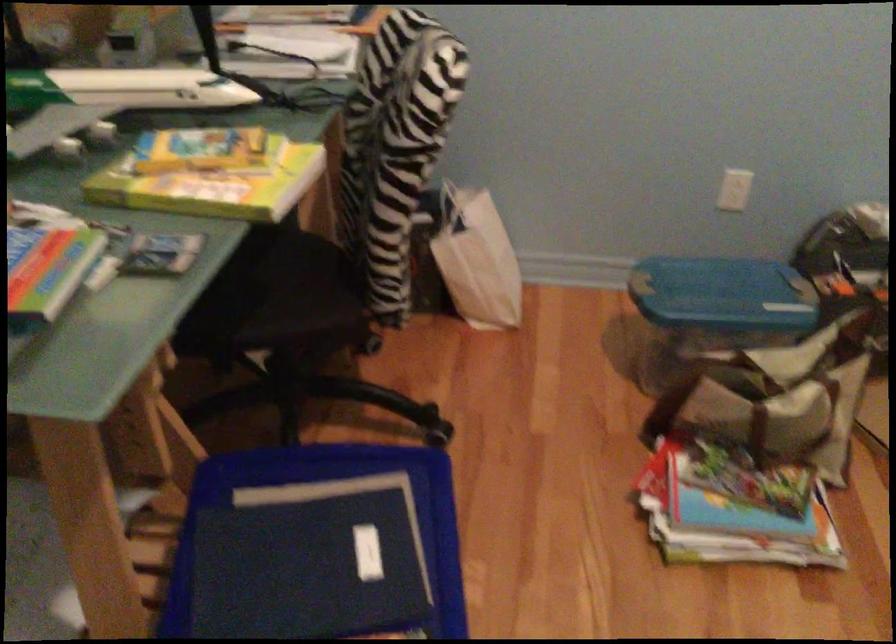
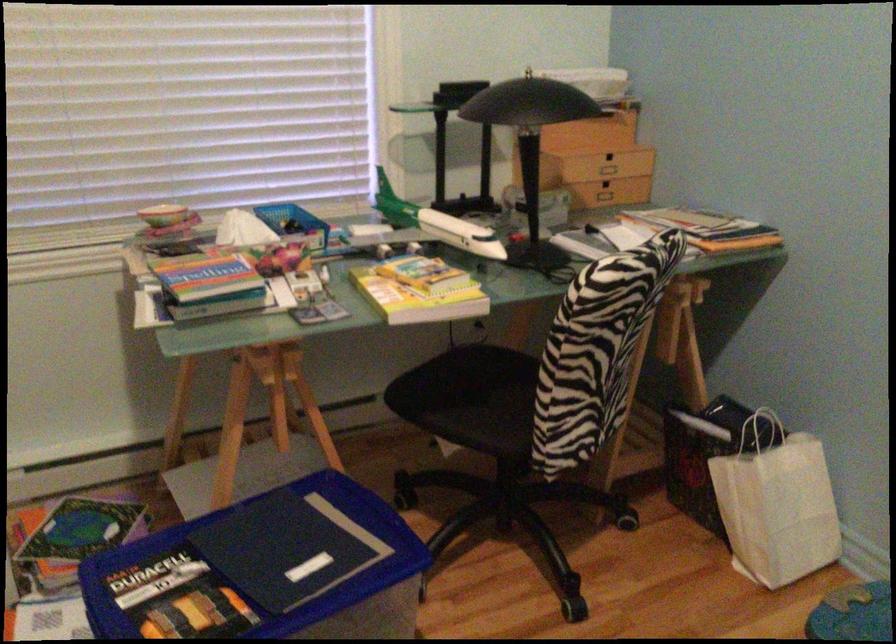
Locate, in the second image, the point that corresponds to point (238, 173) in the first image.

(419, 290)